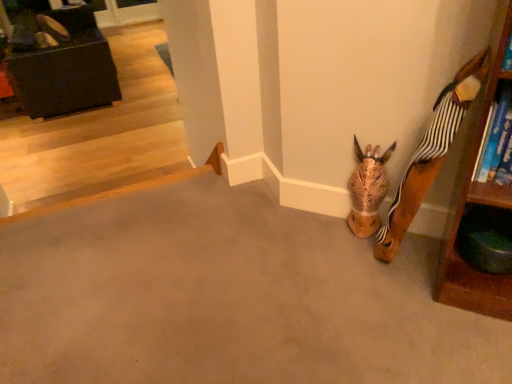
What do you see at coordinates (430, 154) in the screenshot?
I see `wooden giraffe head at lower right` at bounding box center [430, 154].

The height and width of the screenshot is (384, 512). What are the coordinates of `matte brown shoe at upper left` in the screenshot? It's located at (50, 32).

Locate an element on the screen. This screenshot has height=384, width=512. matte black ottoman at upper left is located at coordinates (60, 61).

At what (x,y) coordinates should I click in order to perform the action: click on brown matte concrete at lower right. Please return your answer as a coordinate pair (x, y). This screenshot has width=512, height=384. Looking at the image, I should click on (225, 296).

Describe the element at coordinates (367, 189) in the screenshot. This screenshot has width=512, height=384. I see `brown textured animal head at lower right` at that location.

Where is `wooden giraffe head at lower right`? Image resolution: width=512 pixels, height=384 pixels. wooden giraffe head at lower right is located at coordinates (430, 154).

From the image's perspective, between brown textured animal head at lower right and wooden giraffe head at lower right, who is located below?

brown textured animal head at lower right appears lower in the image.

Considering the sizes of objects brown textured animal head at lower right and wooden giraffe head at lower right in the image provided, who is shorter, brown textured animal head at lower right or wooden giraffe head at lower right?

Standing shorter between the two is brown textured animal head at lower right.

Do you think brown textured animal head at lower right is within wooden giraffe head at lower right, or outside of it?

The correct answer is: outside.

Which of these two, brown textured animal head at lower right or wooden giraffe head at lower right, is thinner?

Thinner between the two is brown textured animal head at lower right.

From the image's perspective, is wooden giraffe head at lower right over matte black ottoman at upper left?

No, from the image's perspective, wooden giraffe head at lower right is not above matte black ottoman at upper left.

Could you tell me if wooden giraffe head at lower right is facing matte black ottoman at upper left?

No, wooden giraffe head at lower right does not turn towards matte black ottoman at upper left.

From a real-world perspective, between wooden giraffe head at lower right and matte black ottoman at upper left, who is vertically lower?

matte black ottoman at upper left, from a real-world perspective.

Is wooden giraffe head at lower right located outside matte black ottoman at upper left?

Yes, wooden giraffe head at lower right is located beyond the bounds of matte black ottoman at upper left.

Relative to wooden giraffe head at lower right, is matte black ottoman at upper left in front or behind?

In the image, matte black ottoman at upper left appears behind wooden giraffe head at lower right.

How many degrees apart are the facing directions of matte black ottoman at upper left and wooden giraffe head at lower right?

The facing directions of matte black ottoman at upper left and wooden giraffe head at lower right are 137 degrees apart.

How much distance is there between matte black ottoman at upper left and wooden giraffe head at lower right?

matte black ottoman at upper left is 3.79 meters from wooden giraffe head at lower right.

In terms of height, does matte black ottoman at upper left look taller or shorter compared to wooden giraffe head at lower right?

Clearly, matte black ottoman at upper left is shorter compared to wooden giraffe head at lower right.

Is brown textured animal head at lower right placed right next to matte black ottoman at upper left?

No, brown textured animal head at lower right is not in contact with matte black ottoman at upper left.

Which object is closer to the camera taking this photo, brown textured animal head at lower right or matte black ottoman at upper left?

brown textured animal head at lower right is in front.

Between brown textured animal head at lower right and matte black ottoman at upper left, which one has more height?

With more height is matte black ottoman at upper left.

How many degrees apart are the facing directions of brown textured animal head at lower right and matte brown shoe at upper left?

136 degrees.

Is brown textured animal head at lower right situated inside matte brown shoe at upper left or outside?

The correct answer is: outside.

Considering the positions of objects brown textured animal head at lower right and matte brown shoe at upper left in the image provided, who is more to the left, brown textured animal head at lower right or matte brown shoe at upper left?

matte brown shoe at upper left is more to the left.

Can you confirm if brown textured animal head at lower right is bigger than matte brown shoe at upper left?

No, brown textured animal head at lower right is not bigger than matte brown shoe at upper left.

From the image's perspective, which one is positioned higher, wooden giraffe head at lower right or matte brown shoe at upper left?

matte brown shoe at upper left is shown above in the image.

Is wooden giraffe head at lower right oriented away from matte brown shoe at upper left?

That's not correct — wooden giraffe head at lower right is not looking away from matte brown shoe at upper left.

Measure the distance between wooden giraffe head at lower right and matte brown shoe at upper left.

wooden giraffe head at lower right and matte brown shoe at upper left are 4.24 meters apart from each other.

Looking at the image, does wooden giraffe head at lower right seem bigger or smaller compared to matte brown shoe at upper left?

Considering their sizes, wooden giraffe head at lower right takes up more space than matte brown shoe at upper left.

Consider the image. Considering the sizes of brown matte concrete at lower right and matte black ottoman at upper left in the image, is brown matte concrete at lower right bigger or smaller than matte black ottoman at upper left?

Considering their sizes, brown matte concrete at lower right takes up less space than matte black ottoman at upper left.

Visually, is brown matte concrete at lower right positioned to the left or to the right of matte black ottoman at upper left?

In the image, brown matte concrete at lower right appears on the right side of matte black ottoman at upper left.

Would you say matte black ottoman at upper left is part of brown matte concrete at lower right's contents?

Definitely not — matte black ottoman at upper left is not inside brown matte concrete at lower right.

Between brown matte concrete at lower right and matte black ottoman at upper left, which one has smaller width?

Thinner between the two is matte black ottoman at upper left.

This screenshot has width=512, height=384. In order to click on animal on the left of wooden giraffe head at lower right in this screenshot , I will do `click(367, 189)`.

Find the location of a particular element. Image resolution: width=512 pixels, height=384 pixels. toy on the right of matte black ottoman at upper left is located at coordinates (430, 154).

Which object lies further to the anchor point matte brown shoe at upper left, brown textured animal head at lower right or brown matte concrete at lower right?

The object further to matte brown shoe at upper left is brown textured animal head at lower right.

Considering their positions, is wooden giraffe head at lower right positioned further to matte black ottoman at upper left than brown matte concrete at lower right?

Based on the image, wooden giraffe head at lower right appears to be further to matte black ottoman at upper left.

From the picture: Based on their spatial positions, is brown matte concrete at lower right or wooden giraffe head at lower right further from brown textured animal head at lower right?

Based on the image, brown matte concrete at lower right appears to be further to brown textured animal head at lower right.

From the picture: Looking at the image, which one is located further to brown matte concrete at lower right, brown textured animal head at lower right or wooden giraffe head at lower right?

wooden giraffe head at lower right.

Which object lies nearer to the anchor point matte black ottoman at upper left, brown matte concrete at lower right or brown textured animal head at lower right?

brown matte concrete at lower right is closer to matte black ottoman at upper left.

From the image, which object appears to be nearer to matte brown shoe at upper left, matte black ottoman at upper left or wooden giraffe head at lower right?

Among the two, matte black ottoman at upper left is located nearer to matte brown shoe at upper left.

Which object lies nearer to the anchor point matte brown shoe at upper left, brown textured animal head at lower right or matte black ottoman at upper left?

matte black ottoman at upper left.

Which object lies nearer to the anchor point brown textured animal head at lower right, matte brown shoe at upper left or brown matte concrete at lower right?

Among the two, brown matte concrete at lower right is located nearer to brown textured animal head at lower right.

The width and height of the screenshot is (512, 384). I want to click on furniture between brown matte concrete at lower right and matte brown shoe at upper left along the z-axis, so click(60, 61).

This screenshot has width=512, height=384. In order to click on animal between brown matte concrete at lower right and matte brown shoe at upper left from front to back in this screenshot , I will do `click(367, 189)`.

The image size is (512, 384). I want to click on animal between brown matte concrete at lower right and wooden giraffe head at lower right in the horizontal direction, so click(367, 189).

This screenshot has width=512, height=384. In order to click on animal between matte black ottoman at upper left and wooden giraffe head at lower right in the horizontal direction in this screenshot , I will do `click(367, 189)`.